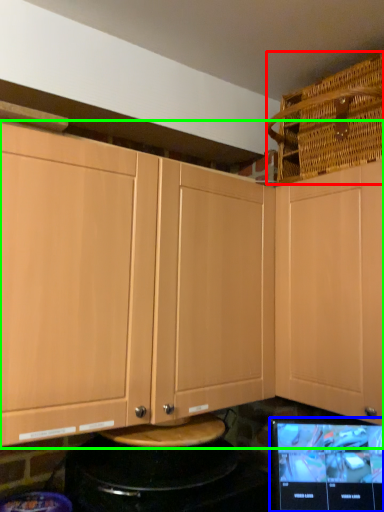
Question: Which object is positioned farthest from basket (highlighted by a red box)? Select from computer monitor (highlighted by a blue box) and cabinetry (highlighted by a green box).

Choices:
 (A) computer monitor
 (B) cabinetry

Answer: (A)